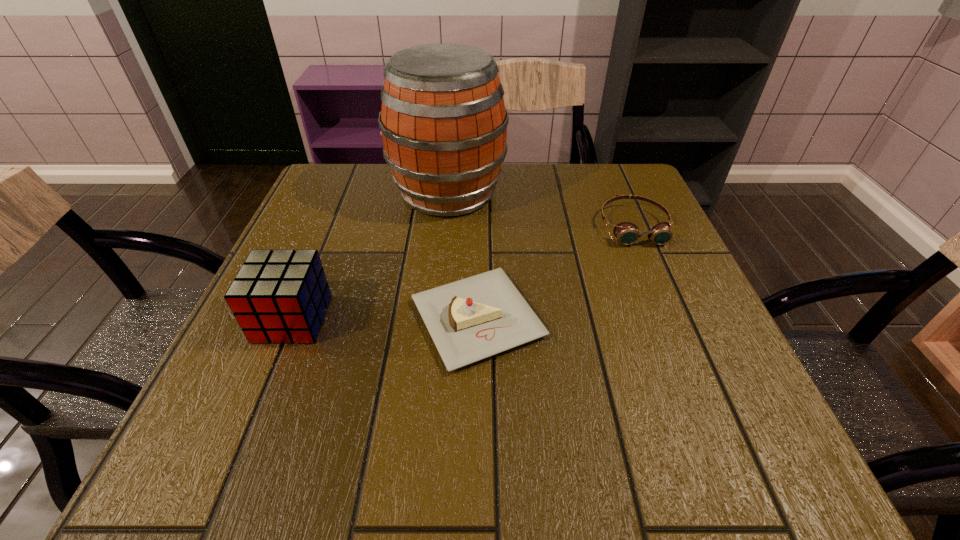
Where is `free space between the goggles and the third shortest object`? Image resolution: width=960 pixels, height=540 pixels. free space between the goggles and the third shortest object is located at coordinates (463, 272).

Locate an element on the screen. The height and width of the screenshot is (540, 960). free area in between the tallest object and the rightmost object is located at coordinates (540, 209).

Image resolution: width=960 pixels, height=540 pixels. I want to click on unoccupied position between the cake and the leftmost object, so click(x=385, y=319).

Find the location of a particular element. The width and height of the screenshot is (960, 540). vacant space in between the goggles and the tallest object is located at coordinates (540, 209).

Where is `blank region between the cake and the goggles`? The width and height of the screenshot is (960, 540). blank region between the cake and the goggles is located at coordinates (556, 272).

Image resolution: width=960 pixels, height=540 pixels. Find the location of `vacant area that lies between the tallest object and the second tallest object`. vacant area that lies between the tallest object and the second tallest object is located at coordinates (371, 256).

Find the location of `vacant space in between the cube and the cake`. vacant space in between the cube and the cake is located at coordinates (385, 319).

Locate an element on the screen. The height and width of the screenshot is (540, 960). vacant space that is in between the cube and the cider is located at coordinates (371, 256).

Where is `unoccupied area between the cake and the cube`? unoccupied area between the cake and the cube is located at coordinates (385, 319).

What are the coordinates of `free point between the third shortest object and the tallest object` in the screenshot? It's located at pos(371,256).